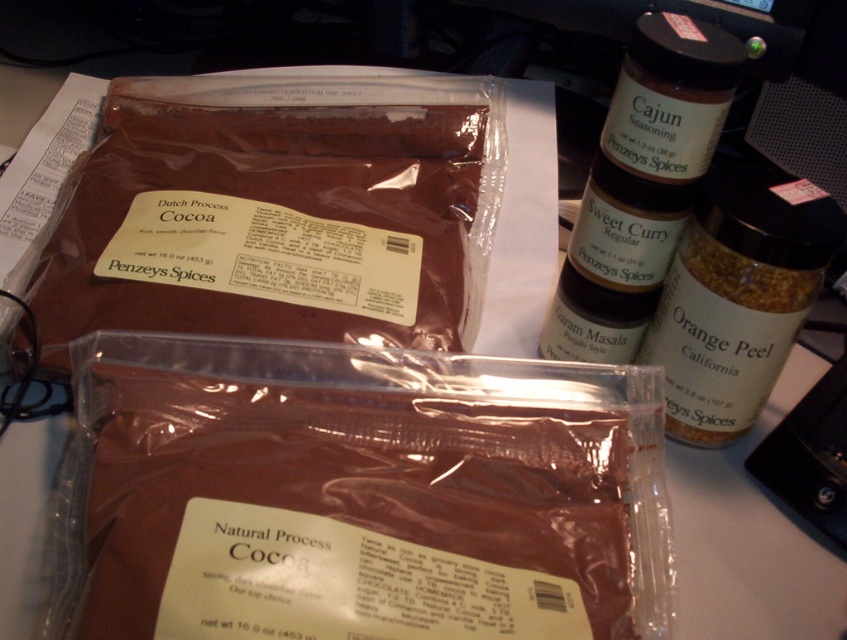
Question: Which point is closer to the camera taking this photo?

Choices:
 (A) (695, 253)
 (B) (314, 160)
 (C) (679, 220)

Answer: (A)

Question: Which point is farther to the camera?

Choices:
 (A) (637, 172)
 (B) (219, 301)

Answer: (B)

Question: In this image, where is brown matte cocoa at upper left located relative to orange peel spice at upper right?

Choices:
 (A) above
 (B) below

Answer: (A)

Question: Which point is farther to the camera?

Choices:
 (A) brown matte cocoa at upper left
 (B) orange peel spice at upper right

Answer: (A)

Question: Is brown matte cocoa at upper left to the left of brown glass jar at upper right from the viewer's perspective?

Choices:
 (A) yes
 (B) no

Answer: (A)

Question: Does brown matte cocoa at upper left appear over brown glass jar at upper right?

Choices:
 (A) no
 (B) yes

Answer: (B)